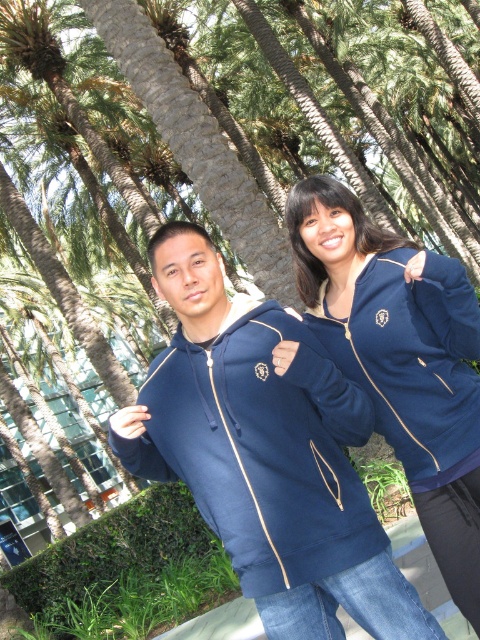
Question: Is matte blue sweatshirt at center below navy blue hoodie at center?

Choices:
 (A) yes
 (B) no

Answer: (A)

Question: Which object appears farthest from the camera in this image?

Choices:
 (A) navy blue fleece sweatshirt at upper right
 (B) matte blue sweatshirt at center
 (C) navy blue hoodie at center

Answer: (C)

Question: Among these objects, which one is nearest to the camera?

Choices:
 (A) navy blue hoodie at center
 (B) navy blue fleece sweatshirt at upper right

Answer: (B)

Question: Estimate the real-world distances between objects in this image. Which object is farther from the navy blue hoodie at center?

Choices:
 (A) navy blue fleece sweatshirt at upper right
 (B) matte blue sweatshirt at center

Answer: (B)

Question: Can you confirm if matte blue sweatshirt at center is positioned to the right of navy blue hoodie at center?

Choices:
 (A) yes
 (B) no

Answer: (B)

Question: Can you confirm if navy blue hoodie at center is positioned below navy blue fleece sweatshirt at upper right?

Choices:
 (A) yes
 (B) no

Answer: (A)